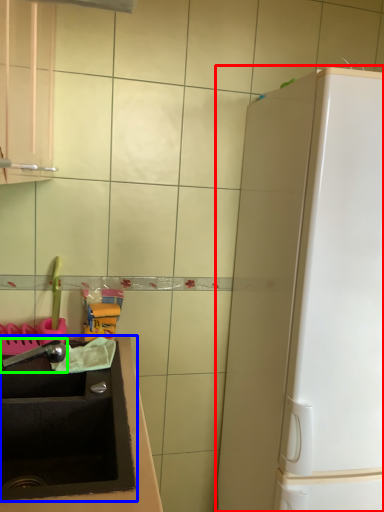
Question: Which is farther away from appliance (highlighted by a red box)? sink (highlighted by a blue box) or faucet (highlighted by a green box)?

Choices:
 (A) sink
 (B) faucet

Answer: (B)